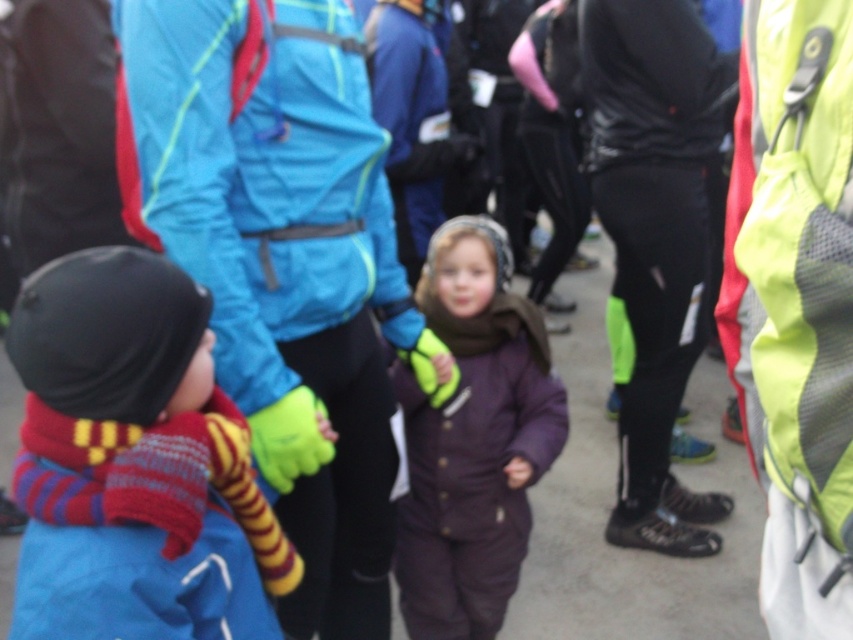
Describe the element at coordinates (125, 460) in the screenshot. I see `knitted wool sweater at left` at that location.

Between point (256, 600) and point (480, 536), which one is positioned behind?

The point (480, 536) is behind.

Identify the location of knitted wool sweater at left. (125, 460).